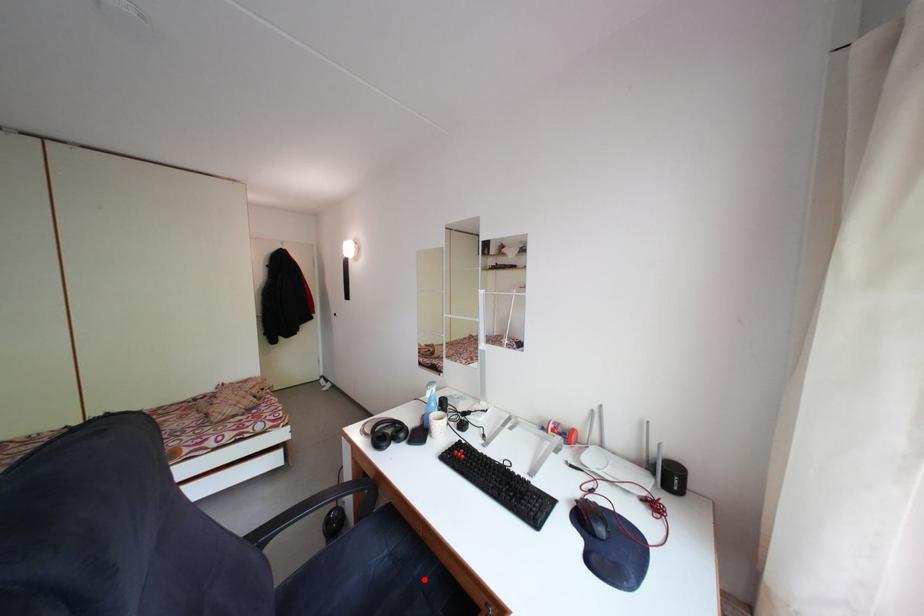
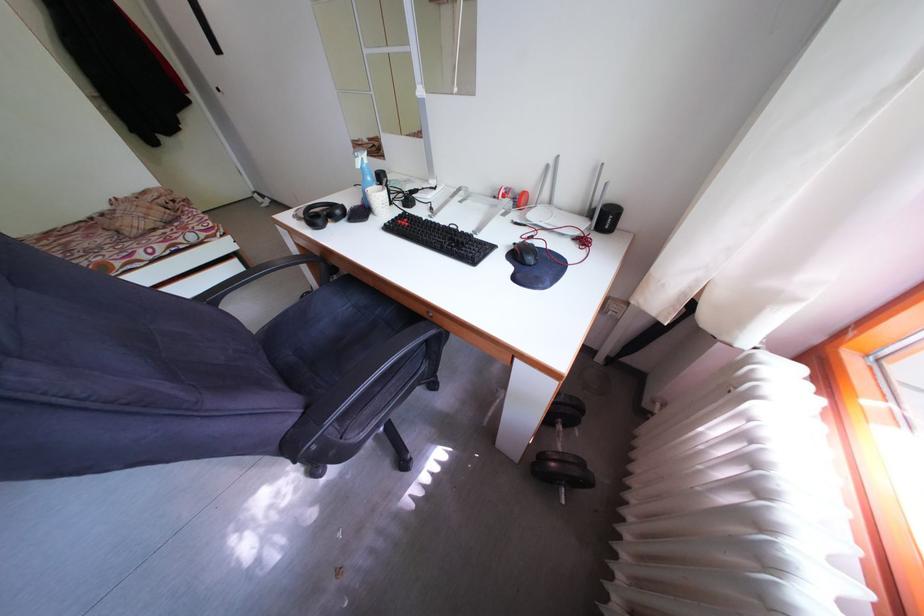
Locate, in the second image, the point that corresponds to the highlighted location in the first image.

(385, 318)